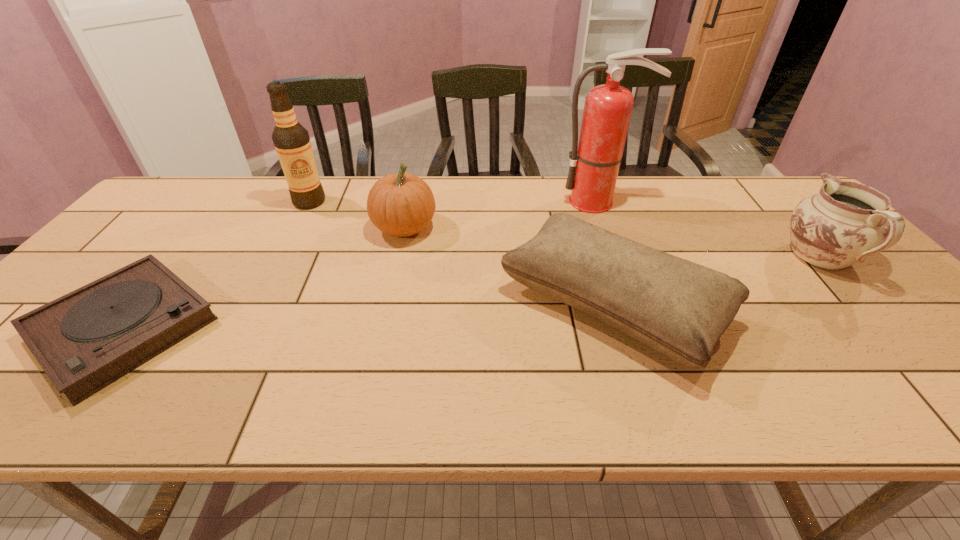
Locate an element on the screen. Image resolution: width=960 pixels, height=540 pixels. vacant area situated on the spout of the rightmost object is located at coordinates (760, 191).

Locate an element on the screen. The width and height of the screenshot is (960, 540). vacant space located 0.180m on the spout of the rightmost object is located at coordinates (766, 197).

Locate an element on the screen. The image size is (960, 540). free space located 0.200m on the right of the fifth tallest object is located at coordinates (809, 305).

This screenshot has width=960, height=540. Find the location of `fire extinguisher that is at the far edge`. fire extinguisher that is at the far edge is located at coordinates (594, 164).

Where is `alcohol that is at the far edge`? This screenshot has width=960, height=540. alcohol that is at the far edge is located at coordinates (291, 140).

This screenshot has width=960, height=540. What are the coordinates of `pumpkin that is at the far edge` in the screenshot? It's located at (401, 204).

Locate an element on the screen. This screenshot has width=960, height=540. object present at the near edge is located at coordinates tap(680, 309).

Find the location of a particular element. This screenshot has height=540, width=960. object located at the right edge is located at coordinates (844, 223).

What are the coordinates of `blank space at the far edge` in the screenshot? It's located at (568, 211).

In order to click on vacant position at the near edge of the desktop in this screenshot , I will do `click(829, 393)`.